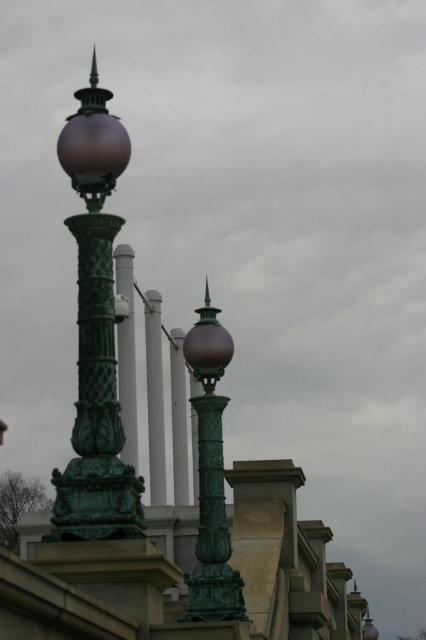
You are standing in front of the green metal pole at center and want to walk towards the green patinated metal street light at left. In which direction should you move?

You should move to the right because the green patinated metal street light at left is to the right of the green metal pole at center.

You are a city planner assessing the height of the green patinated metal street light at left and the green metal pole at center in the image. Which one is taller?

The green metal pole at center is taller than the green patinated metal street light at left.